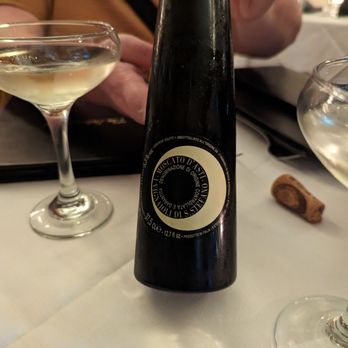
Identify the location of glass. The width and height of the screenshot is (348, 348). (63, 48), (320, 94).